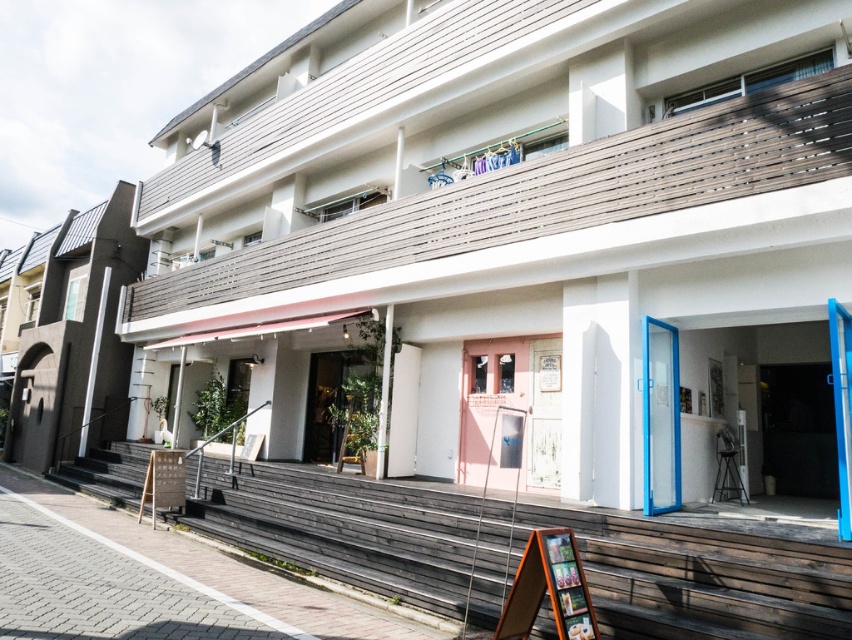
Which is more to the left, pink matte door at center or blue glass door at center?

Positioned to the left is pink matte door at center.

Is pink matte door at center bigger than blue glass door at center?

Yes, pink matte door at center is bigger than blue glass door at center.

Locate an element on the screen. Image resolution: width=852 pixels, height=640 pixels. pink matte door at center is located at coordinates (488, 397).

Identify the location of pink matte door at center. (488, 397).

Is white matte building at center closer to camera compared to dark gray concrete building at left?

Yes, it is.

Does white matte building at center appear under dark gray concrete building at left?

No, white matte building at center is not below dark gray concrete building at left.

The height and width of the screenshot is (640, 852). What do you see at coordinates (522, 225) in the screenshot? I see `white matte building at center` at bounding box center [522, 225].

Identify the location of white matte building at center. This screenshot has height=640, width=852. (522, 225).

Who is shorter, white matte building at center or blue glass door at center?

With less height is blue glass door at center.

Can you confirm if white matte building at center is smaller than blue glass door at center?

Actually, white matte building at center might be larger than blue glass door at center.

Which is behind, point (804, 353) or point (658, 420)?

Point (804, 353)

Locate an element on the screen. The height and width of the screenshot is (640, 852). white matte building at center is located at coordinates (522, 225).